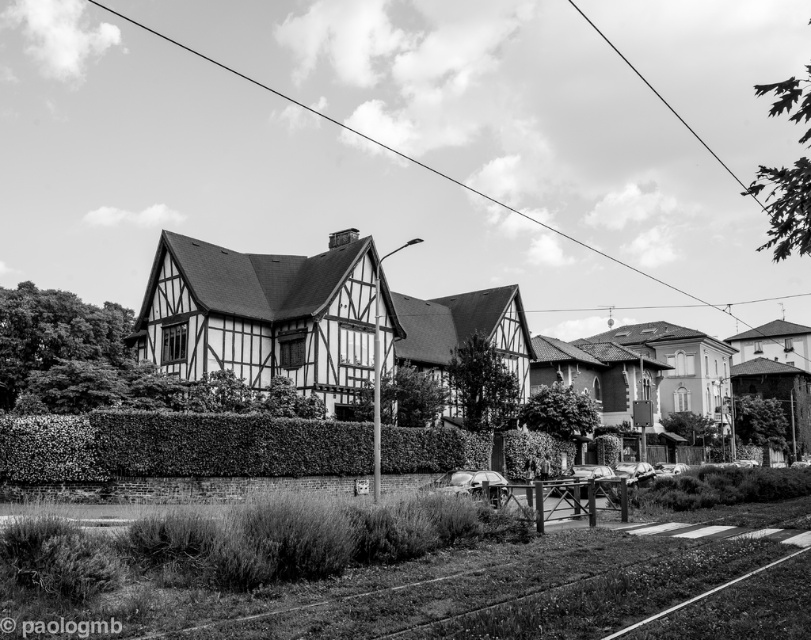
Question: Is green leafy hedge at center smaller than metallic wire at upper center?

Choices:
 (A) no
 (B) yes

Answer: (B)

Question: Which of the following is the closest to the observer?

Choices:
 (A) green leafy hedge at center
 (B) metallic wire at upper center

Answer: (A)

Question: Is green leafy hedge at center to the left of metallic wire at upper center from the viewer's perspective?

Choices:
 (A) no
 (B) yes

Answer: (B)

Question: Which object is farther from the camera taking this photo?

Choices:
 (A) green leafy hedge at center
 (B) metallic wire at upper center

Answer: (B)

Question: Is green leafy hedge at center in front of metallic wire at upper center?

Choices:
 (A) no
 (B) yes

Answer: (B)